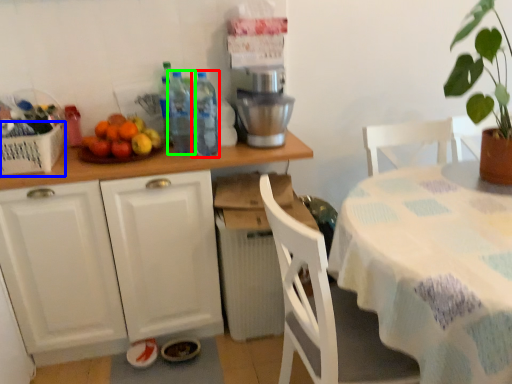
Question: Which object is the closest to the bottle (highlighted by a red box)? Choose among these: basket (highlighted by a blue box) or bottle (highlighted by a green box).

Choices:
 (A) basket
 (B) bottle

Answer: (B)